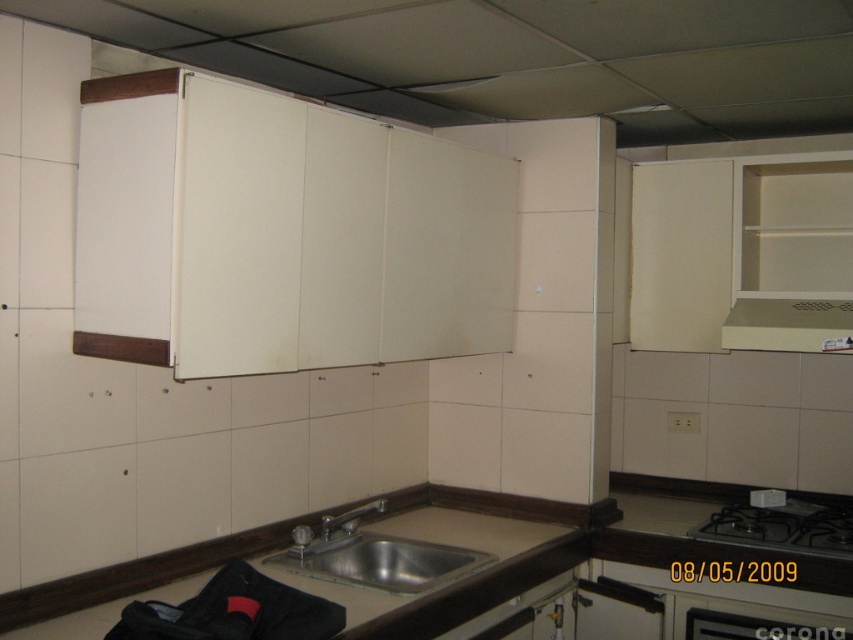
Question: Which object is farther from the camera taking this photo?

Choices:
 (A) brown laminate counter top at lower center
 (B) silver metallic faucet at sink center
 (C) beige matte exhaust hood at upper right
 (D) black matte stove at lower right

Answer: (C)

Question: In this image, where is black matte stove at lower right located relative to beige matte exhaust hood at upper right?

Choices:
 (A) right
 (B) left

Answer: (A)

Question: Which point is farther from the camera taking this photo?

Choices:
 (A) (265, 563)
 (B) (828, 509)

Answer: (B)

Question: Is stainless steel sink at center smaller than silver metallic faucet at sink center?

Choices:
 (A) yes
 (B) no

Answer: (B)

Question: Among these points, which one is farthest from the camera?

Choices:
 (A) pos(325,531)
 (B) pos(300,545)
 (C) pos(71,579)
 (D) pos(811,301)

Answer: (D)

Question: Does stainless steel sink at center have a greater width compared to silver metallic faucet at sink center?

Choices:
 (A) no
 (B) yes

Answer: (B)